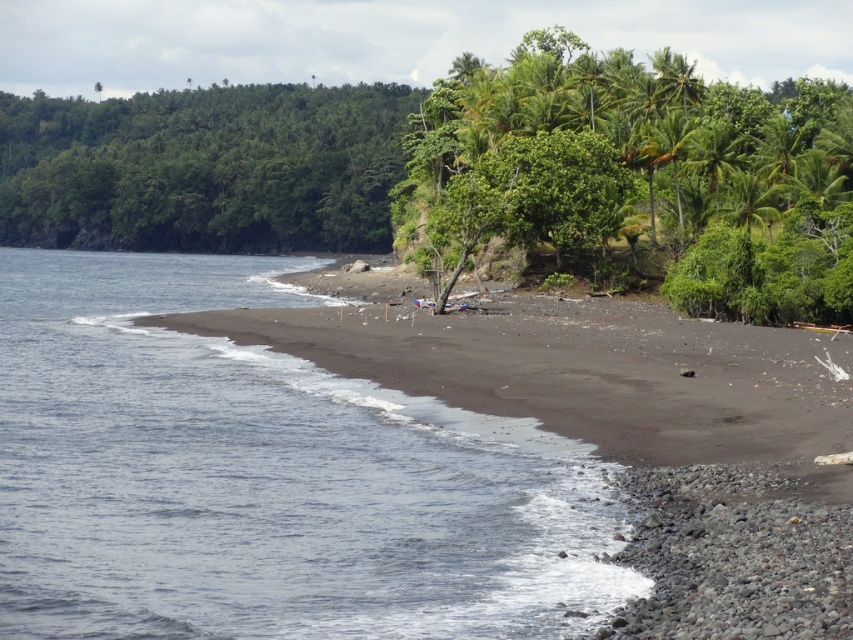
Who is higher up, dark blue water at lower left or green leafy trees at upper right?

green leafy trees at upper right is higher up.

Between point (86, 394) and point (461, 180), which one is positioned in front?

Point (86, 394) is more forward.

I want to click on dark blue water at lower left, so click(x=263, y=477).

Where is `dark blue water at lower left`? The image size is (853, 640). dark blue water at lower left is located at coordinates (263, 477).

Is dark blue water at lower left above green leafy trees at upper left?

No, dark blue water at lower left is not above green leafy trees at upper left.

Who is more forward, (505, 548) or (376, 182)?

Point (505, 548) is more forward.

The width and height of the screenshot is (853, 640). In order to click on dark blue water at lower left in this screenshot , I will do `click(263, 477)`.

Does point (679, 72) come behind point (106, 116)?

No, (679, 72) is in front of (106, 116).

Which is below, green leafy trees at upper right or green leafy trees at upper left?

Positioned lower is green leafy trees at upper left.

Is point (741, 150) positioned before point (125, 218)?

Yes, it is in front of point (125, 218).

This screenshot has width=853, height=640. What are the coordinates of `green leafy trees at upper right` in the screenshot? It's located at (656, 161).